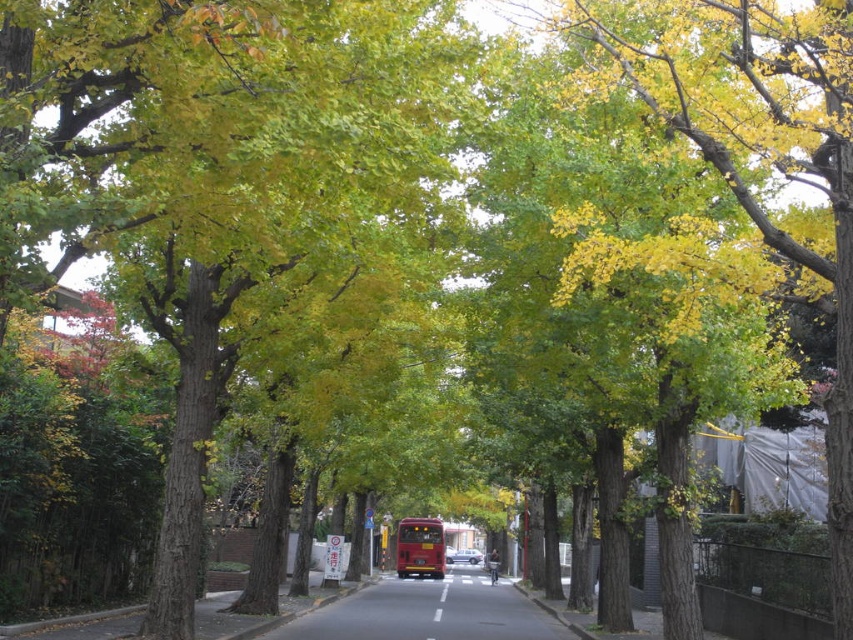
You are a pedestrian standing on the sidewalk and want to cross the street. You see the smooth asphalt road at center and the metallic silver car at center. Which object is closer to the left side of the street?

The smooth asphalt road at center is positioned on the left side of the metallic silver car at center, so it is closer to the left side of the street.

You are a delivery drone flying above the urban street scene. You need to deliver a package to the metallic silver car at center. However, there is a smooth asphalt road at center in your path. Can you safely fly over the road to reach the car without any obstacles?

The smooth asphalt road at center has a greater height compared to the metallic silver car at center. Therefore, the delivery drone cannot safely fly over the road to reach the metallic silver car at center since the road is taller than the car, creating an obstacle in the drone path.

Looking at this image, you are a delivery drone flying above the urban street scene. You need to land on the smooth asphalt road at center. What are the coordinates where you should land?

The coordinates for the smooth asphalt road at center are at point [427,612].